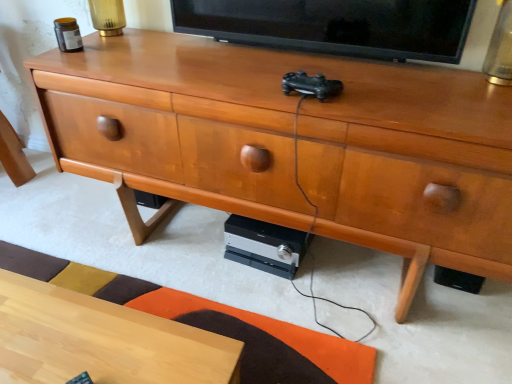
Question: Is black glossy tv at upper center to the left or to the right of light wood desk at lower left in the image?

Choices:
 (A) right
 (B) left

Answer: (A)

Question: In the image, is black glossy tv at upper center positioned in front of or behind light wood desk at lower left?

Choices:
 (A) behind
 (B) front

Answer: (A)

Question: Which object is positioned closest to the silver/black plastic stereo at lower center?

Choices:
 (A) wooden chest of drawers at center
 (B) black glossy tv at upper center
 (C) light wood desk at lower left

Answer: (A)

Question: Considering the real-world distances, which object is closest to the black glossy tv at upper center?

Choices:
 (A) wooden chest of drawers at center
 (B) light wood desk at lower left
 (C) silver/black plastic stereo at lower center

Answer: (A)